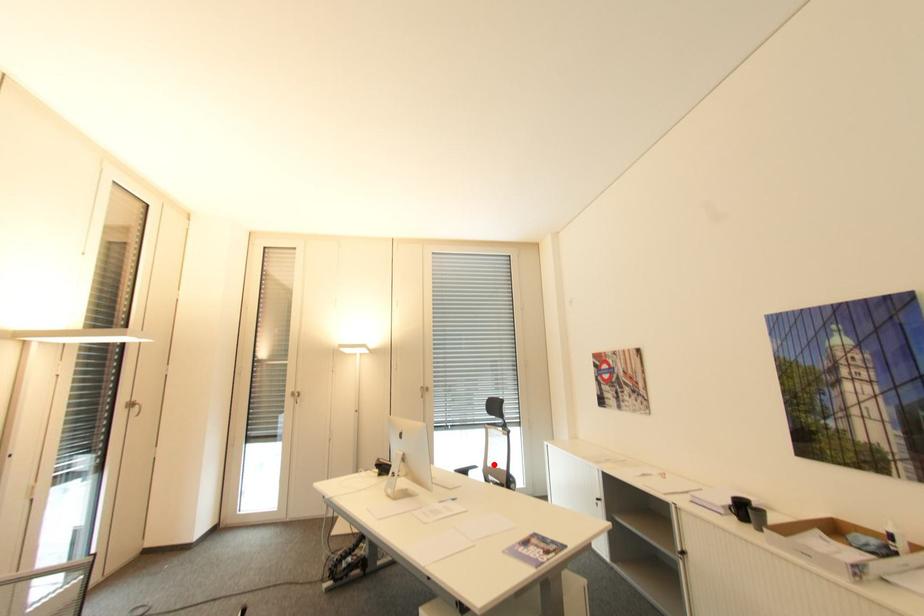
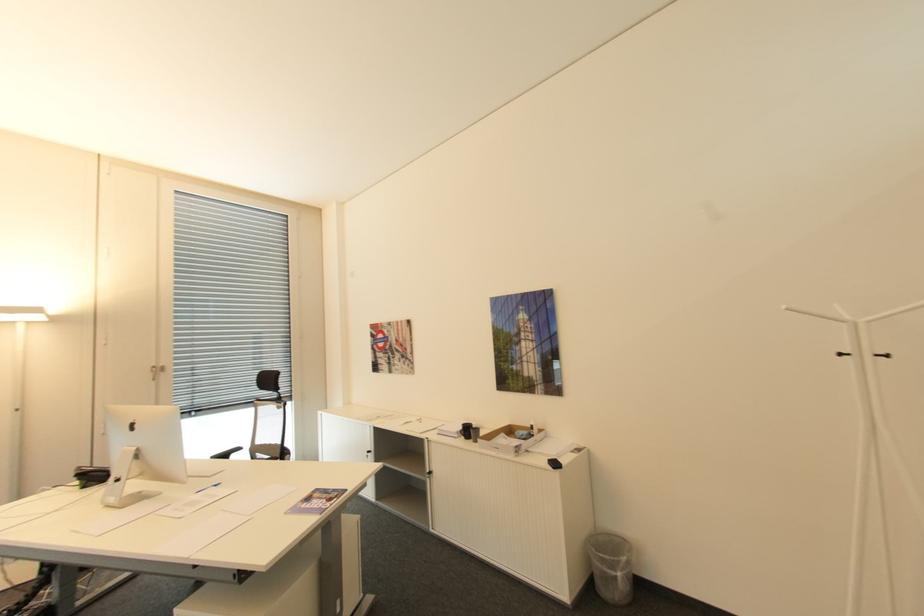
Question: I am providing you with two images of the same scene from different viewpoints. A red point is shown in image1. For the corresponding object point in image2, is it positioned nearer or farther from the camera?

Choices:
 (A) Nearer
 (B) Farther

Answer: (A)